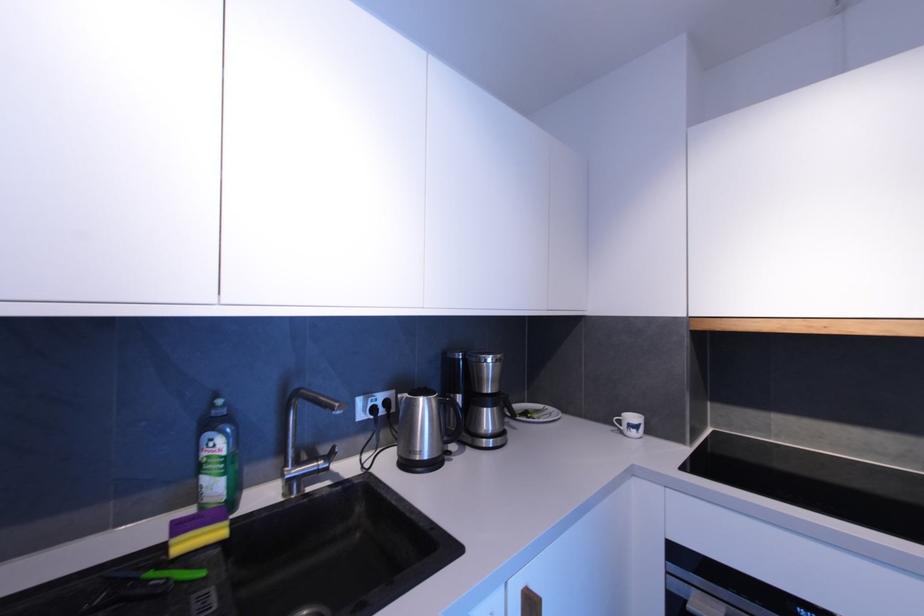
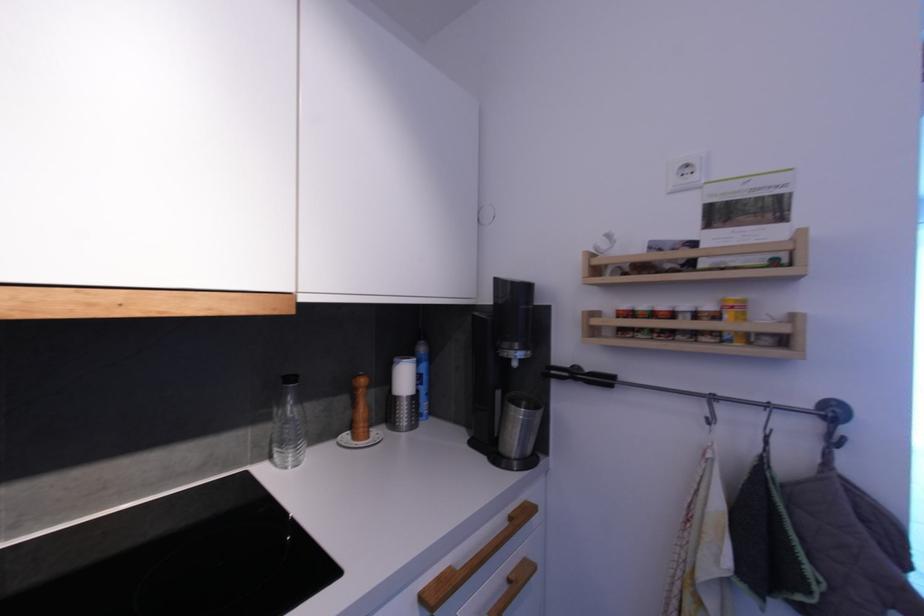
Question: The camera is either moving clockwise (left) or counter-clockwise (right) around the object. The first image is from the beginning of the video and the second image is from the end. Is the camera moving left or right when shooting the video?

Choices:
 (A) Left
 (B) Right

Answer: (A)